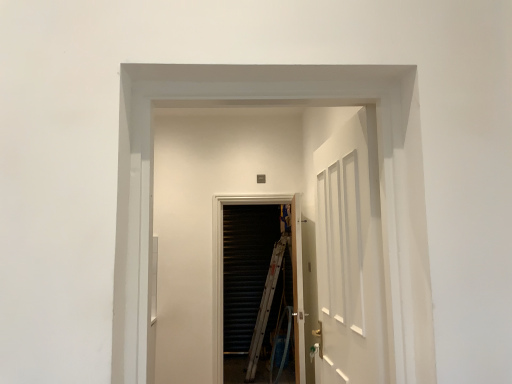
Identify the location of free location above black metal screen door at center (from a real-world perspective). (259, 190).